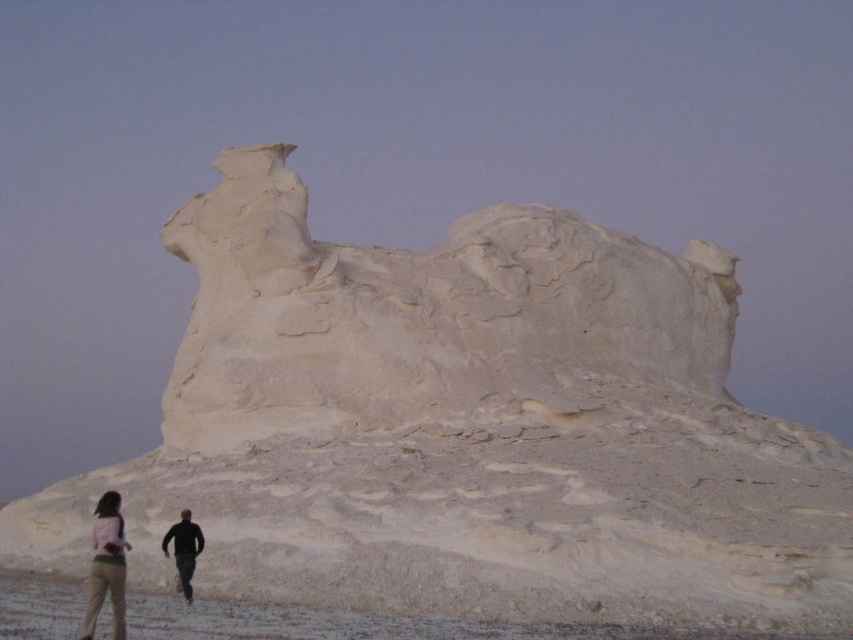
You are a GUI agent. You are given a task and a screenshot of the screen. Output one action in this format:
    pyautogui.click(x=<x>, y=<y>)
    Task: Click on the white sandstone rock at center
    Image resolution: width=853 pixels, height=640 pixels.
    Given the screenshot: What is the action you would take?
    pyautogui.click(x=424, y=316)

Between point (653, 323) and point (196, 541), which one is positioned behind?

The point (653, 323) is behind.

Is point (173, 424) closer to camera compared to point (198, 540)?

No, (173, 424) is further to viewer.

I want to click on white sandstone rock at center, so click(424, 316).

Which is in front, point (189, 600) or point (97, 529)?

Point (97, 529)

Is point (184, 579) farther from camera compared to point (106, 493)?

That is False.

This screenshot has width=853, height=640. In order to click on light pink fabric pants at lower left in this screenshot , I will do `click(107, 566)`.

Image resolution: width=853 pixels, height=640 pixels. Identify the location of light pink fabric pants at lower left. (107, 566).

Based on the photo, is light pink fabric pants at lower left taller than black matte man at lower left?

Yes.

Which is below, light pink fabric pants at lower left or black matte man at lower left?

black matte man at lower left is lower down.

Measure the distance between light pink fabric pants at lower left and camera.

light pink fabric pants at lower left and camera are 44.85 meters apart.

Where is `light pink fabric pants at lower left`? This screenshot has width=853, height=640. light pink fabric pants at lower left is located at coordinates (107, 566).